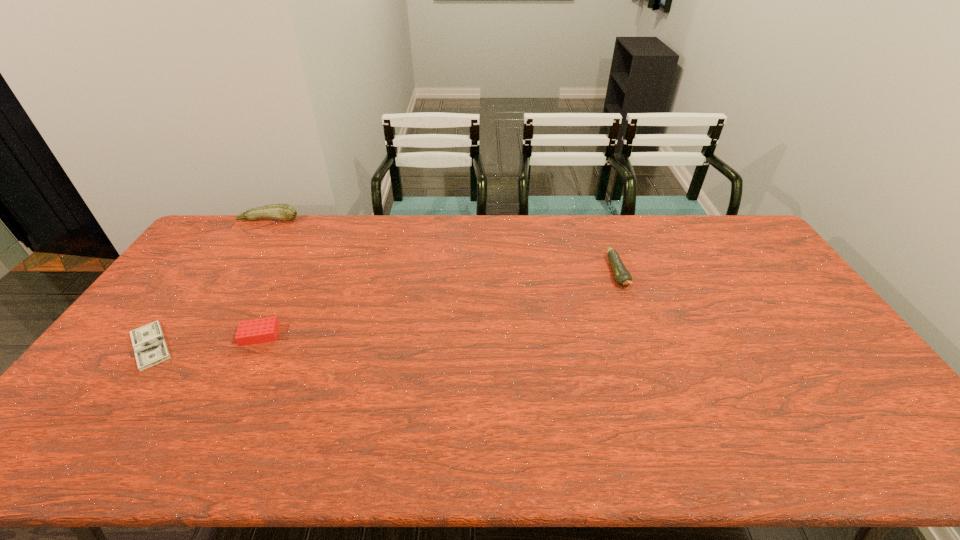
Identify the location of the farthest object. (285, 212).

The height and width of the screenshot is (540, 960). Find the location of `the farther zucchini`. the farther zucchini is located at coordinates (285, 212).

Locate an element on the screen. The width and height of the screenshot is (960, 540). the shorter zucchini is located at coordinates (622, 276).

Locate an element on the screen. The width and height of the screenshot is (960, 540). the third shortest object is located at coordinates (622, 276).

Find the location of `the second shortest object`. the second shortest object is located at coordinates (249, 332).

The width and height of the screenshot is (960, 540). In order to click on the third object from left to right in this screenshot , I will do [249, 332].

In order to click on the shortest object in this screenshot , I will do `click(149, 345)`.

Find the location of `free spot located 0.400m at the stem end of the left zucchini`. free spot located 0.400m at the stem end of the left zucchini is located at coordinates (219, 296).

I want to click on free space located 0.340m at the blossom end of the rightmost object, so click(658, 384).

Locate an element on the screen. This screenshot has width=960, height=540. free spot located 0.140m on the left of the Lego is located at coordinates (191, 335).